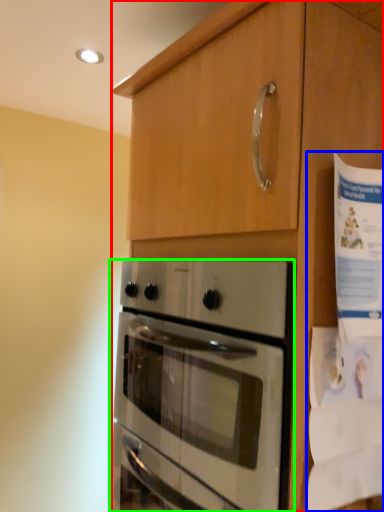
Question: Considering the real-world distances, which object is closest to cabinetry (highlighted by a red box)? paper (highlighted by a blue box) or oven (highlighted by a green box).

Choices:
 (A) paper
 (B) oven

Answer: (A)